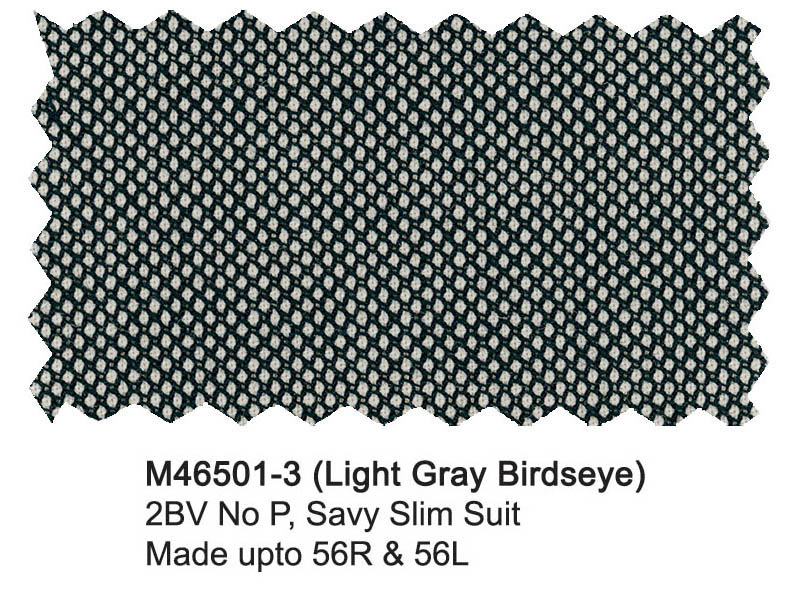
Find the location of a particular element. light is located at coordinates (298, 137).